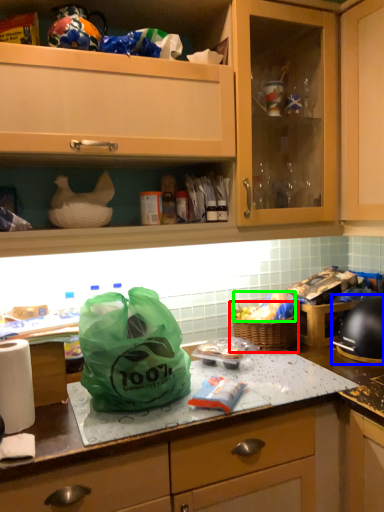
Question: Which object is positioned farthest from picnic basket (highlighted by a red box)? Select from home appliance (highlighted by a blue box) and food (highlighted by a green box).

Choices:
 (A) home appliance
 (B) food

Answer: (A)